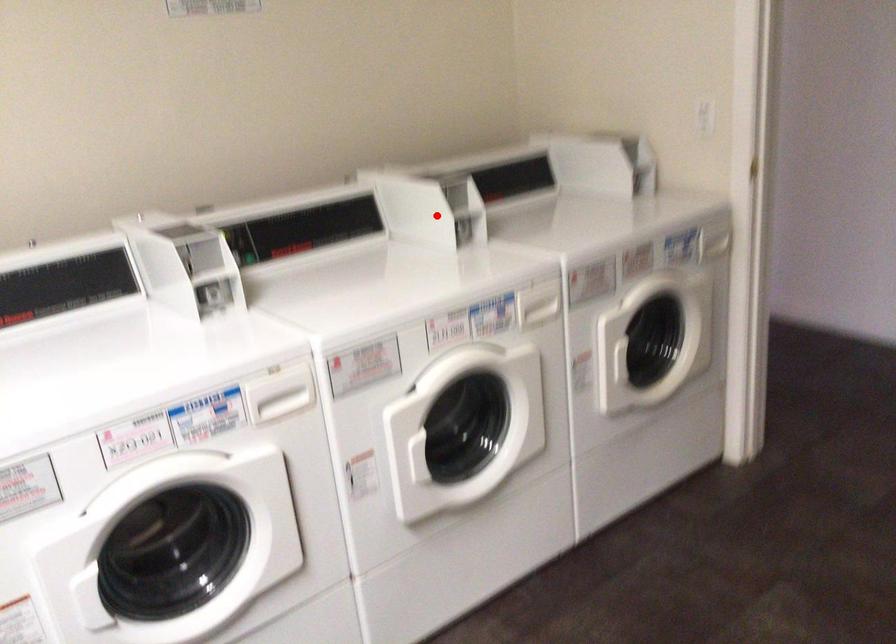
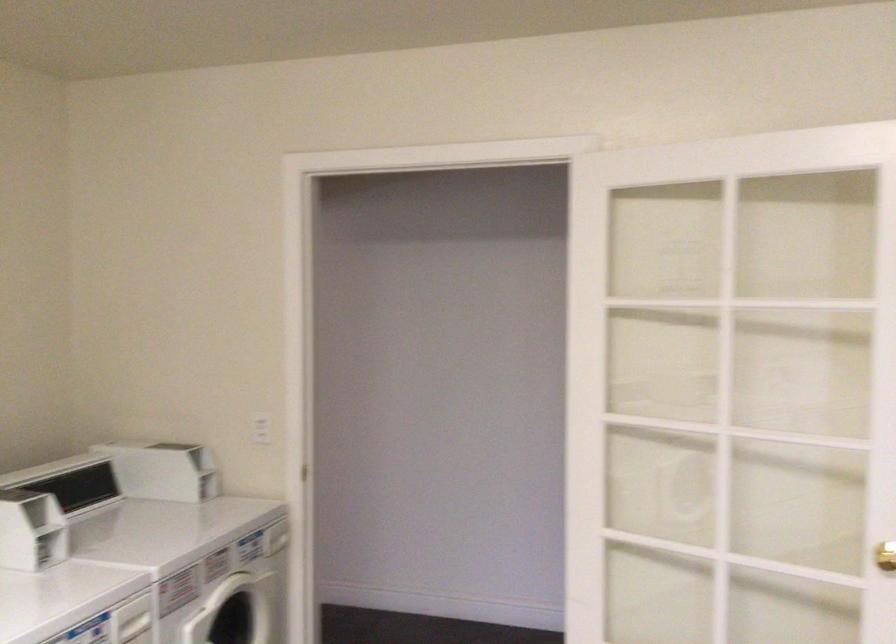
The point at the highlighted location is marked in the first image. Where is the corresponding point in the second image?

(30, 529)